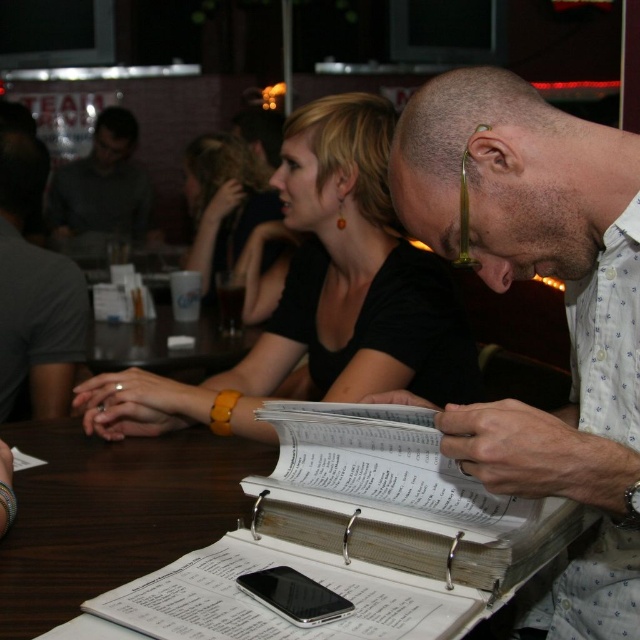
Question: Based on their relative distances, which object is nearer to the gray fabric shirt at left?

Choices:
 (A) beige paper book at center
 (B) gray fabric shirt at upper left
 (C) black matte shirt at center
 (D) black matte hair at center

Answer: (C)

Question: Does white paper at center appear on the left side of gray fabric shirt at left?

Choices:
 (A) yes
 (B) no

Answer: (B)

Question: Which point is closer to the camera?

Choices:
 (A) (193, 144)
 (B) (465, 109)
 (C) (35, 180)
 (D) (531, 528)

Answer: (D)

Question: Among these points, which one is farthest from the camera?

Choices:
 (A) (616, 262)
 (B) (92, 500)

Answer: (B)

Question: Can you confirm if brown wooden table at center is positioned to the right of black matte hair at center?

Choices:
 (A) no
 (B) yes

Answer: (B)

Question: Is black matte shirt at center thinner than gray fabric shirt at upper left?

Choices:
 (A) no
 (B) yes

Answer: (A)